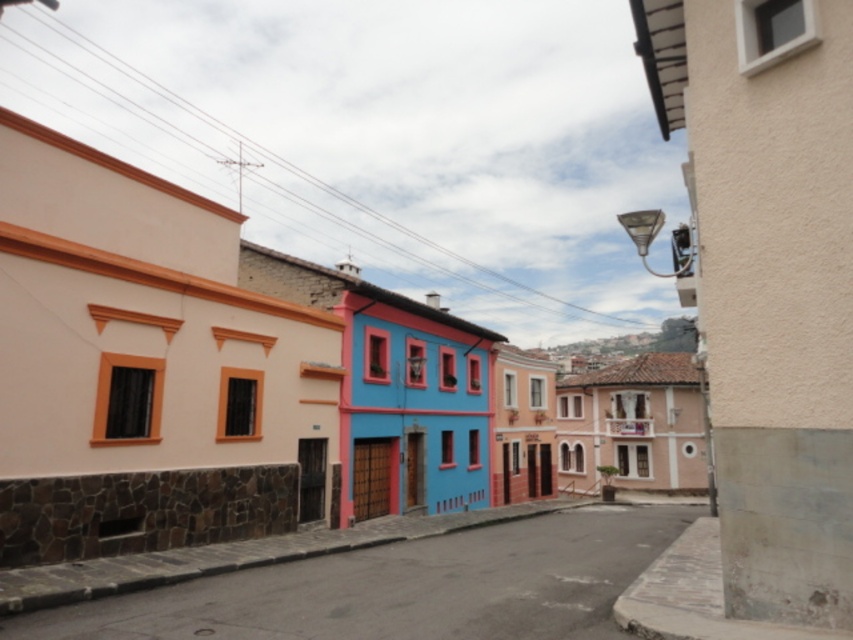
You are a delivery person trying to park your 2.5 meter wide delivery van on the street. The van requires a space that is at least 3 meters wide. Looking at the image, can you determine if there is enough space between the smooth stucco building at center and the smooth concrete pavement at center to park your van?

The smooth stucco building at center is larger in size compared to the smooth concrete pavement at center, but the exact width between them isn

You are a delivery person trying to navigate through the street. You see the smooth stucco building at center and the smooth concrete pavement at center. Which one is closer to you as you approach the street?

The smooth stucco building at center is closer to you because the smooth concrete pavement at center is behind it.

You are a delivery person standing on the smooth concrete pavement at center. You need to deliver a package to the smooth stucco building at center. Which direction should you look to find the building?

The smooth stucco building at center is located above the smooth concrete pavement at center, so you should look upward to find the building.